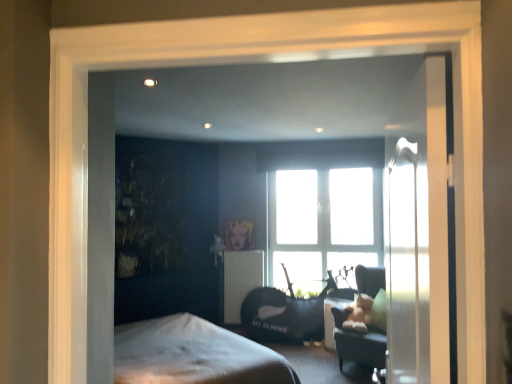
Question: Is velvet dark gray swivel chair at center, positioned as the second swivel chair in back-to-front order, to the left or to the right of clear glass door at right in the image?

Choices:
 (A) right
 (B) left

Answer: (A)

Question: Does point (375, 289) appear closer or farther from the camera than point (401, 319)?

Choices:
 (A) closer
 (B) farther

Answer: (B)

Question: Considering the real-world distances, which object is farthest from the velvet dark gray swivel chair at center, which ranks as the first swivel chair in front-to-back order?

Choices:
 (A) transparent glass window at center
 (B) clear glass door at right
 (C) metallic gold picture frame at center
 (D) matte black table at lower center
 (E) white textured radiator at center

Answer: (B)

Question: Which is farther from the transparent glass window at center?

Choices:
 (A) velvet dark gray swivel chair at center, positioned as the second swivel chair in back-to-front order
 (B) velvet black swivel chair at center, acting as the 1th swivel chair starting from the back
 (C) white textured radiator at center
 (D) metallic gold picture frame at center
 (E) matte black table at lower center

Answer: (A)